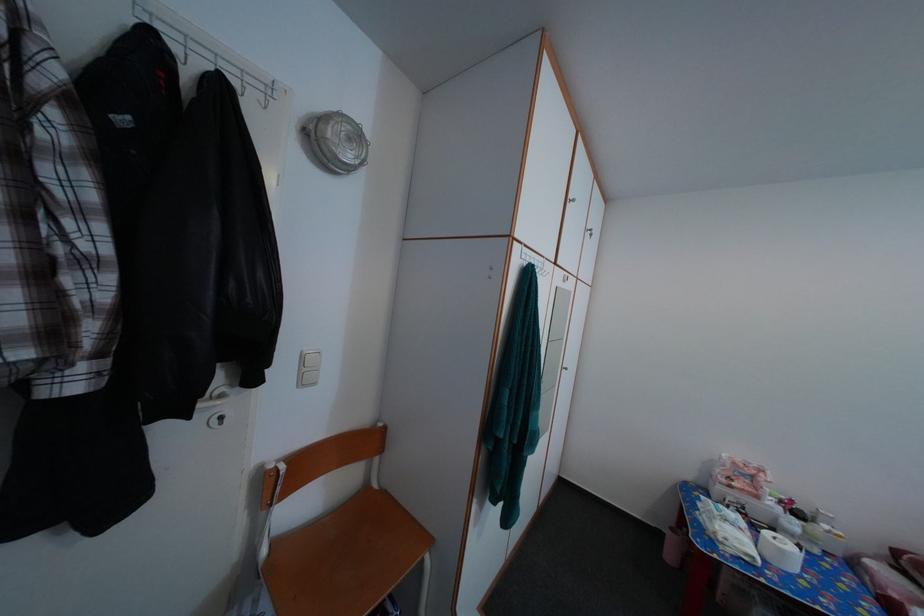
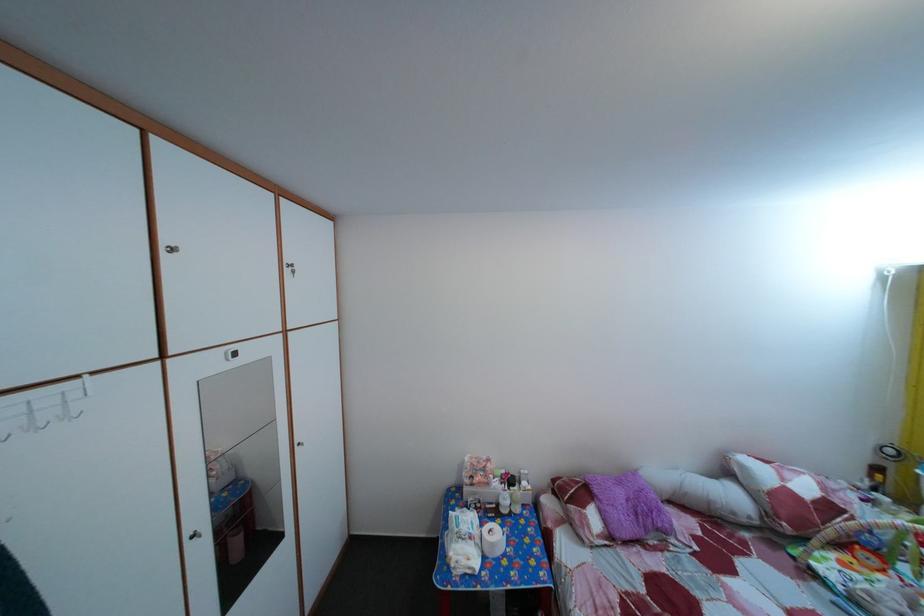
Where in the second image is the point corresponding to point 810,519 from the first image?

(524, 485)